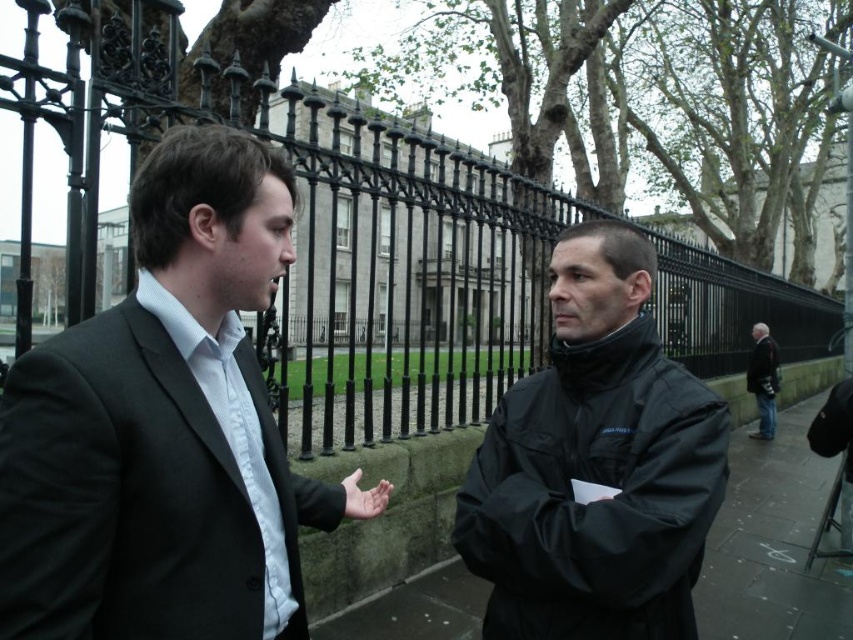
Question: Is matte black suit at left positioned before dark gray jacket at right?

Choices:
 (A) yes
 (B) no

Answer: (A)

Question: Can you confirm if matte black suit at left is thinner than dark gray jacket at right?

Choices:
 (A) no
 (B) yes

Answer: (B)

Question: Which point is farther to the camera?

Choices:
 (A) (759, 364)
 (B) (651, 448)

Answer: (A)

Question: Which point is farther to the camera?

Choices:
 (A) (770, 404)
 (B) (242, 140)
 (C) (689, 452)

Answer: (A)

Question: Among these objects, which one is nearest to the camera?

Choices:
 (A) matte black suit at left
 (B) dark gray jacket at right
 (C) black fabric jacket at center
 (D) black matte jacket at center

Answer: (A)

Question: Is the position of matte black suit at left less distant than that of black fabric jacket at center?

Choices:
 (A) no
 (B) yes

Answer: (B)